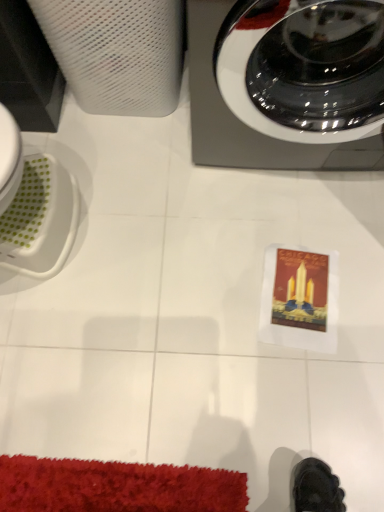
Identify the location of blank space to the left of metallic gray washing machine at upper right. (135, 184).